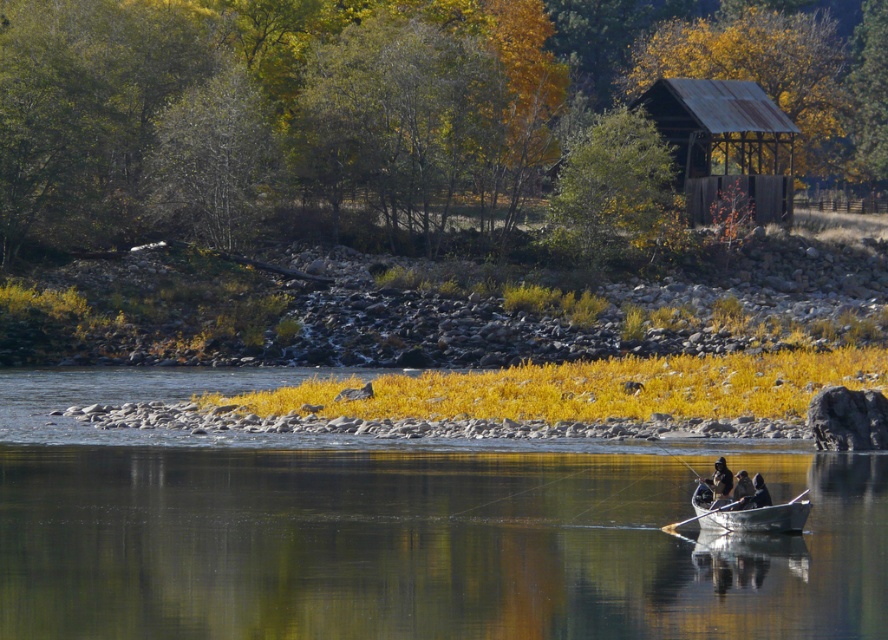
Between clear water at center and dark brown leather jacket at lower right, which one has less height?

dark brown leather jacket at lower right

Between point (324, 595) and point (714, 474), which one is positioned behind?

The point (714, 474) is behind.

Which is behind, point (739, 582) or point (718, 476)?

Point (718, 476)

Image resolution: width=888 pixels, height=640 pixels. In order to click on clear water at center in this screenshot , I will do `click(423, 547)`.

Is metallic gray canoe at center to the left of dark brown leather jacket at lower right from the viewer's perspective?

Incorrect, metallic gray canoe at center is not on the left side of dark brown leather jacket at lower right.

Which is in front, point (744, 518) or point (725, 467)?

Point (744, 518) is in front.

Locate an element on the screen. The height and width of the screenshot is (640, 888). metallic gray canoe at center is located at coordinates (760, 516).

Does rusty metal hut at upper right have a greater width compared to metallic gray canoe at center?

Yes.

Locate an element on the screen. rusty metal hut at upper right is located at coordinates (724, 141).